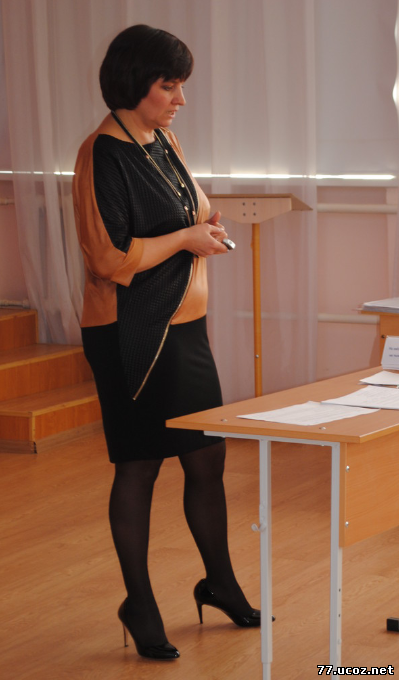
Locate an element on the screen. wood table is located at coordinates (376, 424).